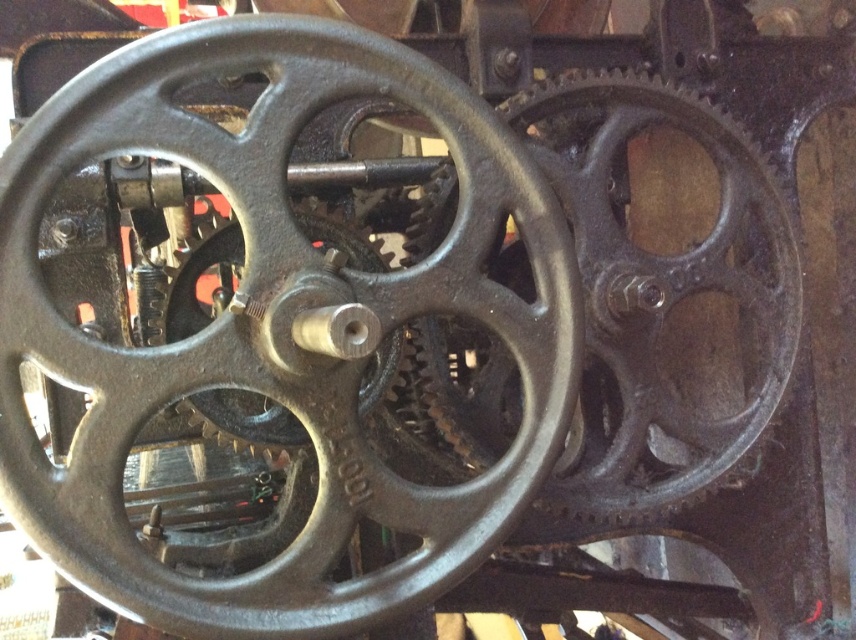
You are an engineer inspecting a mechanical assembly. You notice two central components labeled as the black cast iron wheel at center and the matte black gear at center. Which of these two components has a larger size?

The black cast iron wheel at center is bigger than the matte black gear at center, so the black cast iron wheel at center has a larger size.

You are an engineer inspecting the mechanical assembly. You notice the black cast iron wheel at center and the matte black gear at center. Which component is positioned closer to your viewpoint?

The black cast iron wheel at center is closer to the viewer than the matte black gear at center.